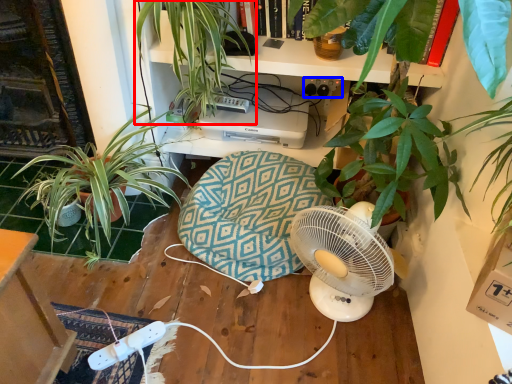
Question: Among these objects, which one is farthest to the camera, houseplant (highlighted by a red box) or plug (highlighted by a blue box)?

Choices:
 (A) houseplant
 (B) plug

Answer: (B)